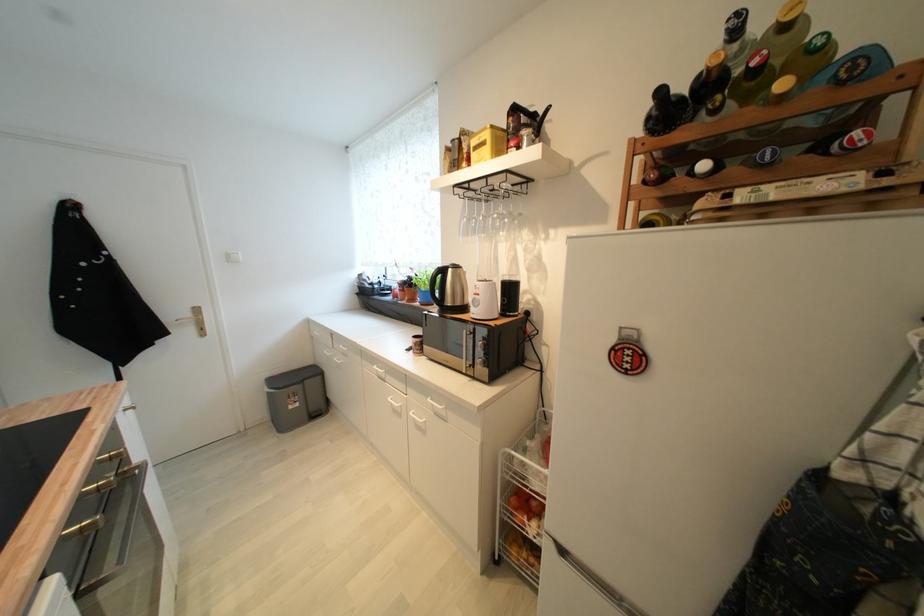
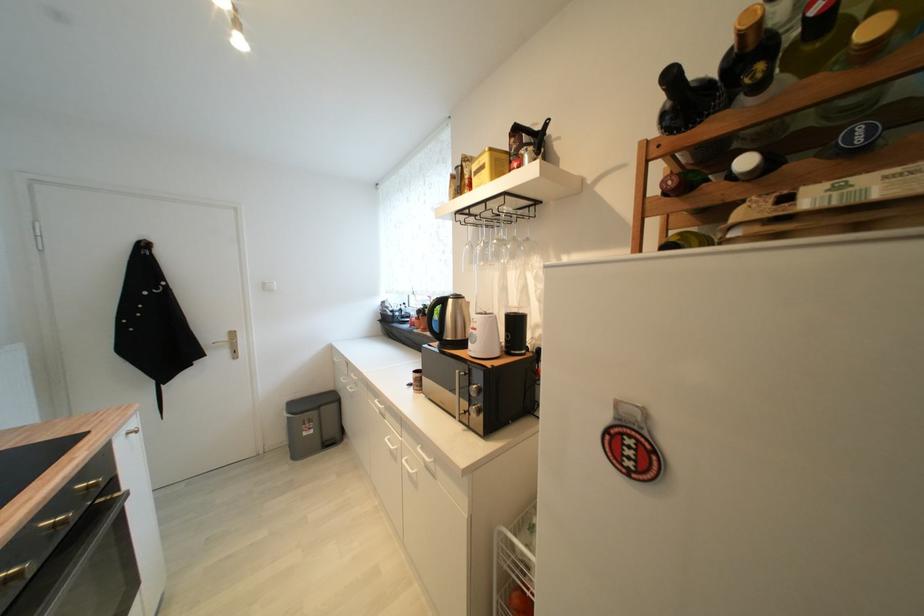
In the second image, find the point that corresponds to (x=235, y=261) in the first image.

(271, 289)